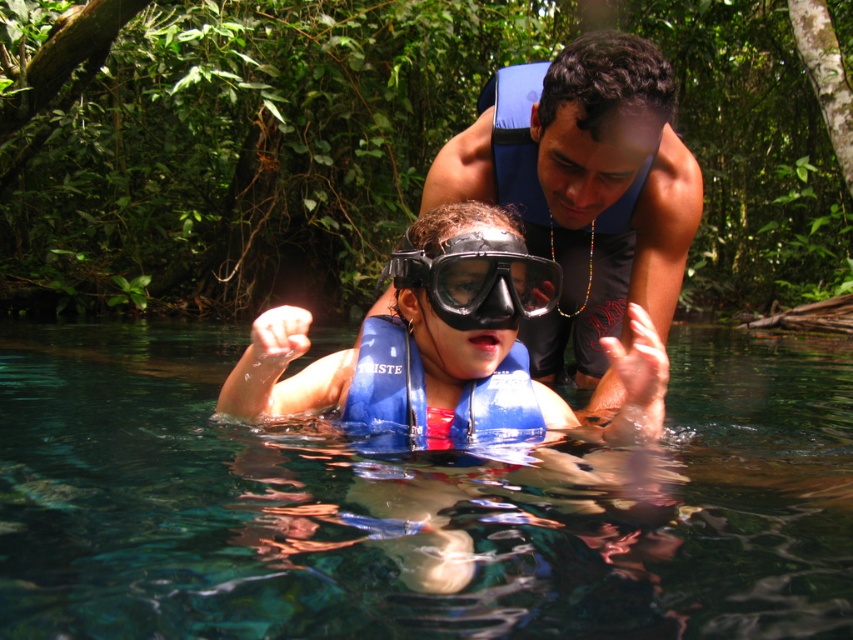
Can you confirm if transparent blue life vest at center is smaller than black matte goggles at center?

No, transparent blue life vest at center is not smaller than black matte goggles at center.

Which is above, transparent blue life vest at center or black matte goggles at center?

black matte goggles at center is above.

Which is in front, point (320, 573) or point (461, 234)?

Point (320, 573) is more forward.

This screenshot has width=853, height=640. In order to click on transparent blue life vest at center in this screenshot , I will do `click(415, 506)`.

Measure the distance from blue life vest at upper center to blue matte life jacket at center.

17.45 inches

Where is `blue life vest at upper center`? The image size is (853, 640). blue life vest at upper center is located at coordinates (613, 189).

The image size is (853, 640). Find the location of `blue life vest at upper center`. blue life vest at upper center is located at coordinates (613, 189).

Is transparent blue life vest at center taller than blue matte life vest at center?

No.

Does transparent blue life vest at center have a lesser height compared to blue matte life vest at center?

Yes.

Locate an element on the screen. transparent blue life vest at center is located at coordinates (415, 506).

The image size is (853, 640). Find the location of `transparent blue life vest at center`. transparent blue life vest at center is located at coordinates (415, 506).